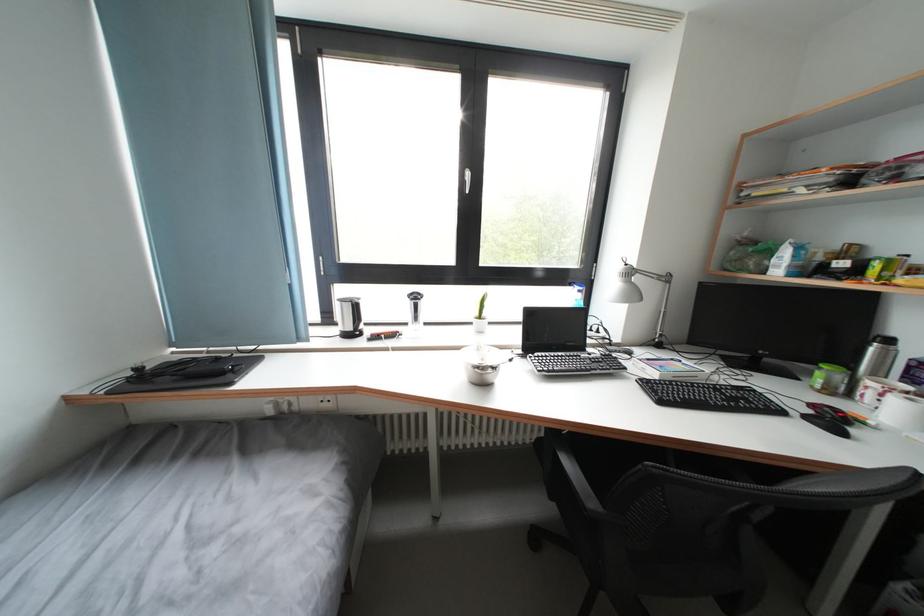
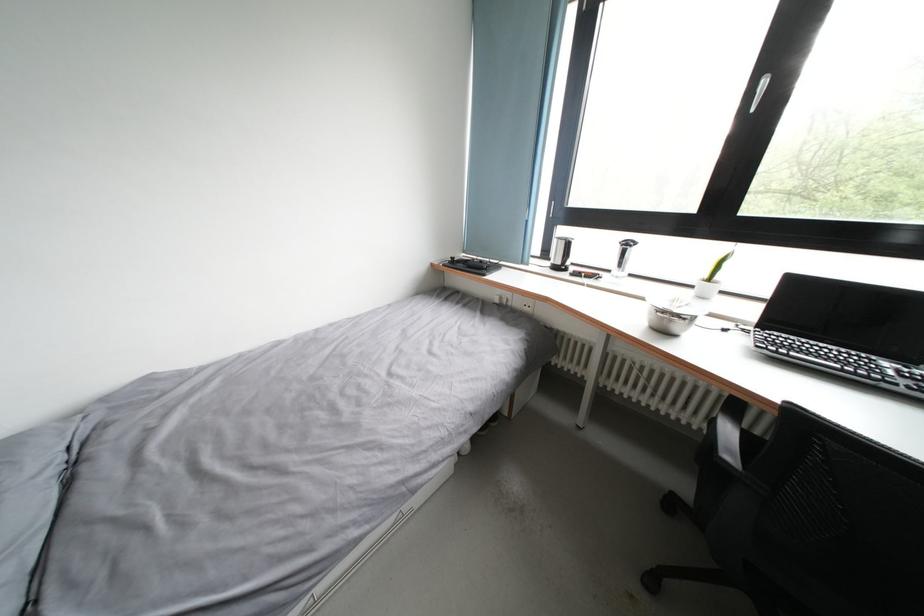
Find the pixel in the second image that matches pixel 416 309 in the first image.

(624, 254)